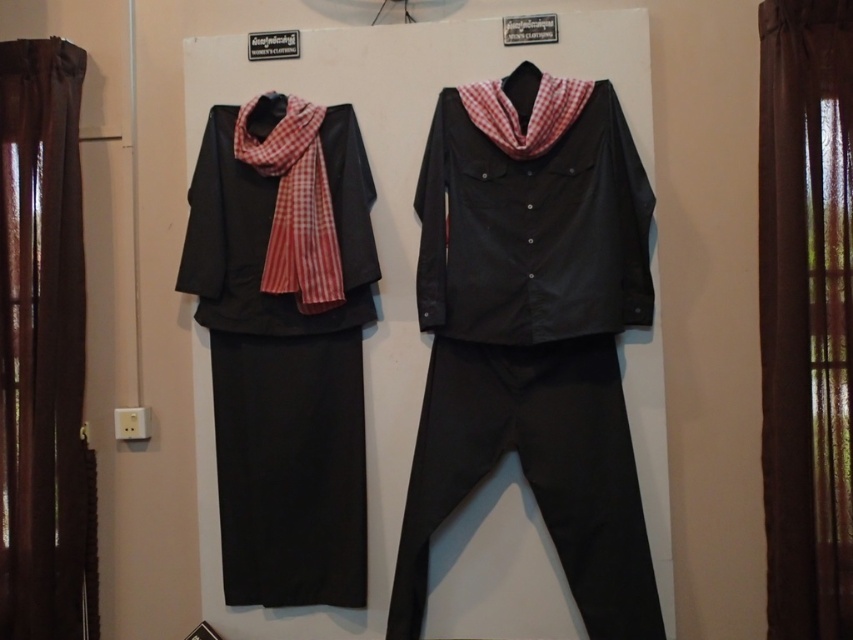
Question: Which point is closer to the camera?

Choices:
 (A) (511, 102)
 (B) (265, 266)
 (C) (572, 154)

Answer: (C)

Question: Is matte black jacket at left thinner than red checkered scarf at left?

Choices:
 (A) no
 (B) yes

Answer: (A)

Question: Is matte black shirt at center further to camera compared to matte black skirt at left?

Choices:
 (A) no
 (B) yes

Answer: (A)

Question: Which of these objects is positioned farthest from the matte black skirt at left?

Choices:
 (A) red checkered scarf at center
 (B) red checkered scarf at left
 (C) matte black jacket at center

Answer: (A)

Question: Which object is closer to the camera taking this photo?

Choices:
 (A) matte black jacket at left
 (B) matte black shirt at center

Answer: (B)

Question: Can you confirm if matte black shirt at center is thinner than matte black jacket at center?

Choices:
 (A) yes
 (B) no

Answer: (B)